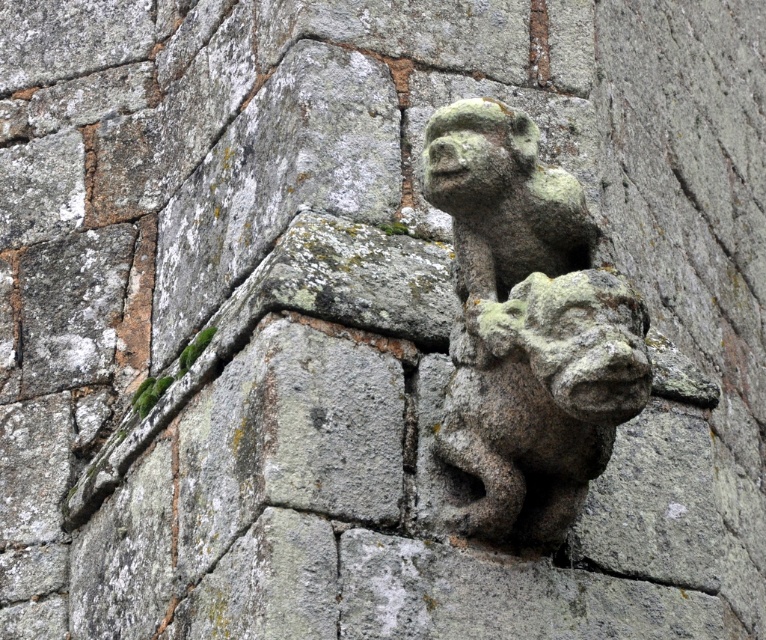
What are the coordinates of `green mossy stone gargoyle at center` in the screenshot? It's located at (526, 330).

Is green mossy stone gargoyle at center in front of green mossy stone gargoyle at upper center?

No.

Who is more distant from viewer, (542, 390) or (483, 472)?

Point (483, 472)

Locate an element on the screen. This screenshot has height=640, width=766. green mossy stone gargoyle at center is located at coordinates (526, 330).